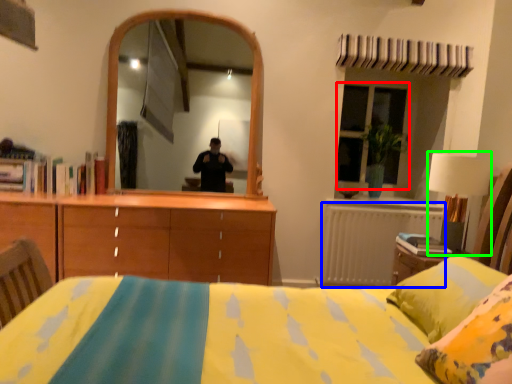
Question: Considering the real-world distances, which object is farthest from window (highlighted by a red box)? radiator (highlighted by a blue box) or table lamp (highlighted by a green box)?

Choices:
 (A) radiator
 (B) table lamp

Answer: (B)